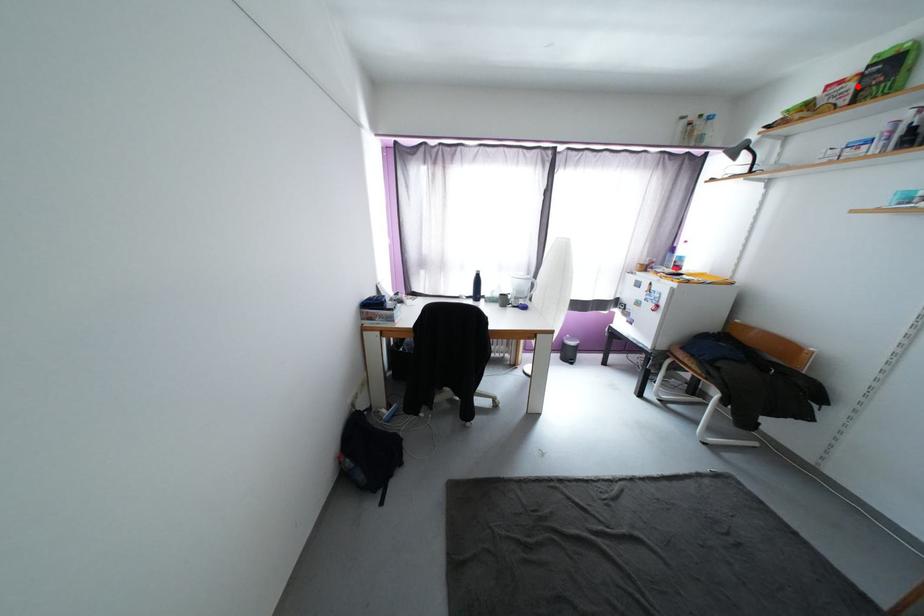
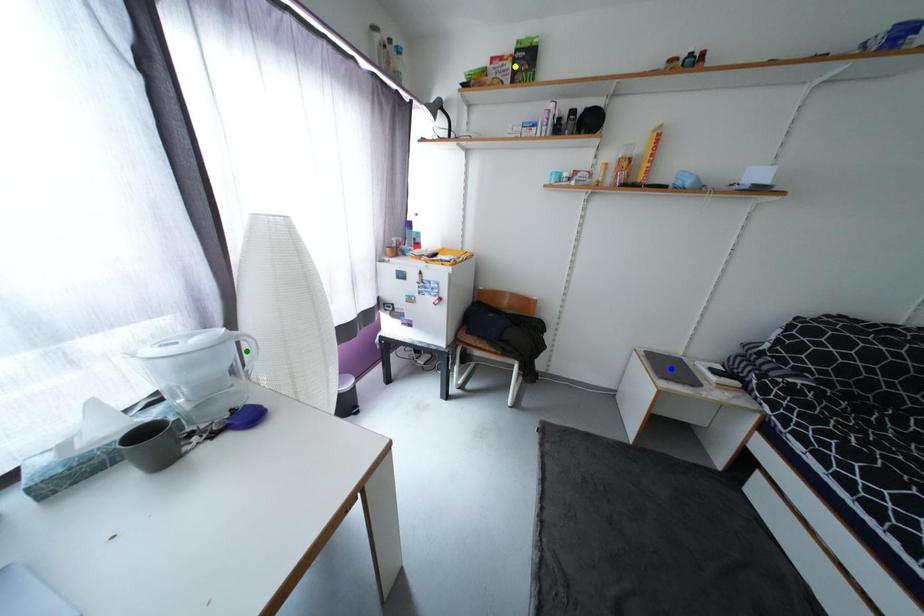
Question: I am providing you with two images of the same scene from different viewpoints. A red point is marked on the first image. You are given multiple points on the second image. Which point in image 2 represents the same 3d spot as the red point in image 1?

Choices:
 (A) blue point
 (B) green point
 (C) yellow point

Answer: (C)